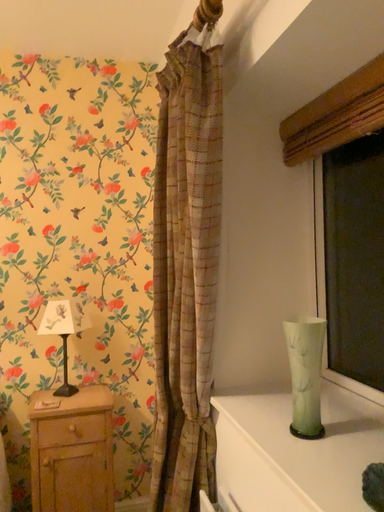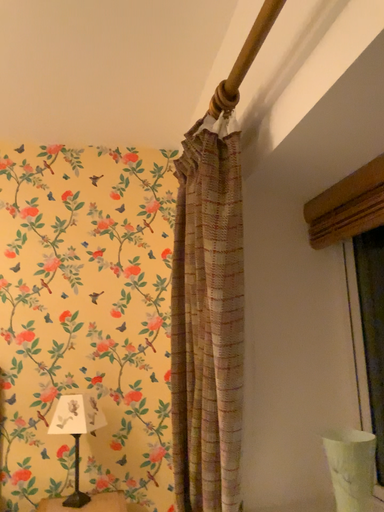
Question: How did the camera likely rotate when shooting the video?

Choices:
 (A) rotated upward
 (B) rotated downward

Answer: (A)